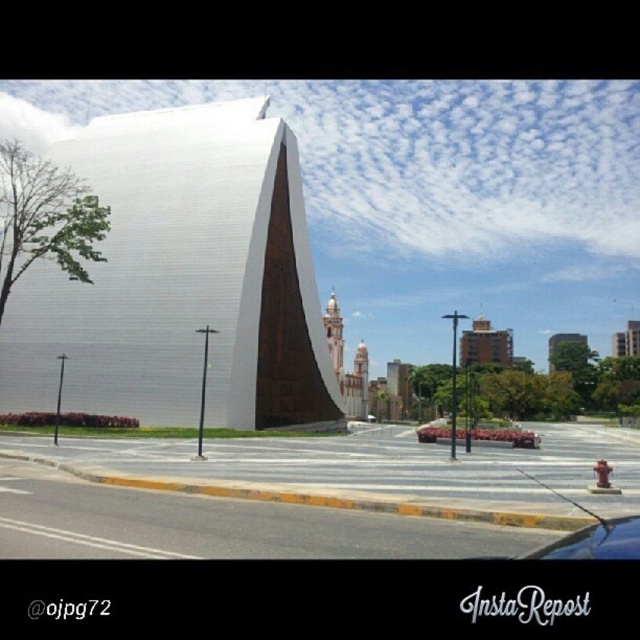
You are an urban planner assessing the visual impact of the white matte building at center and the green textured tree at upper center. Which object occupies more horizontal space in the scene?

The white matte building at center has a larger width than the green textured tree at upper center, so it occupies more horizontal space in the scene.

You are standing at the point marked as point (x=428, y=436) and want to take a photo of the modern architectural structure. Considering the distance between you and the structure, will you be able to capture the entire building in one frame without moving? Please explain your reasoning based on the distance provided.

The point (x=428, y=436) is 186.35 feet away from the viewer. Since the modern architectural structure is in the foreground and the distance is relatively large, it is possible that capturing the entire building in one frame might be challenging. However, without specific information about the camera lens and sensor size, it is difficult to determine definitively. Generally, at 186 feet, a wide or ultra wide angle lens would be necessary to capture the entire structure in one frame.

Based on the photo, you are standing in front of the modern building and want to take a photo of the shiny black car at lower right and the green textured tree at upper center. Which object is positioned to the left when framing both in your camera?

The shiny black car at lower right is to the left of green textured tree at upper center, so when framing both in the camera, the shiny black car at lower right will be on the left side.